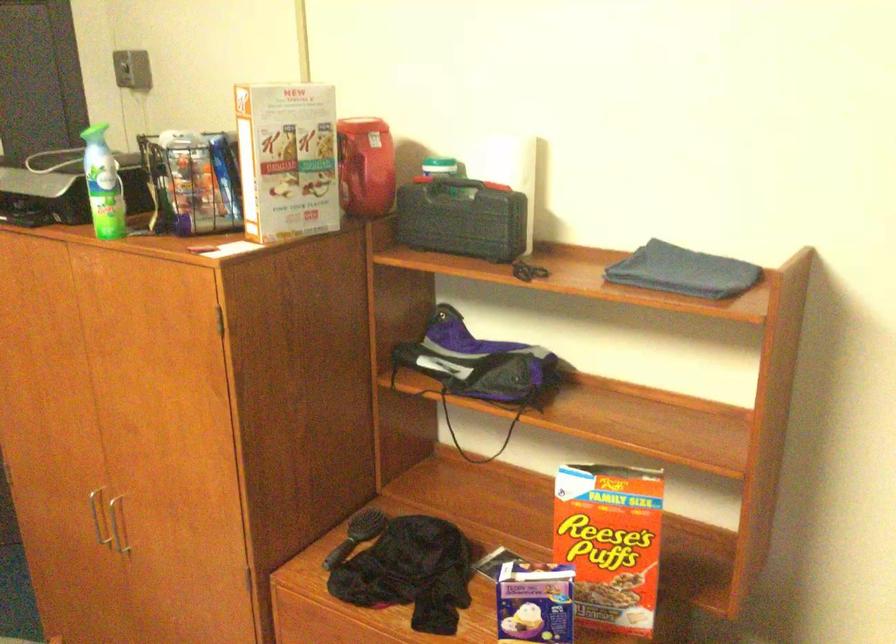
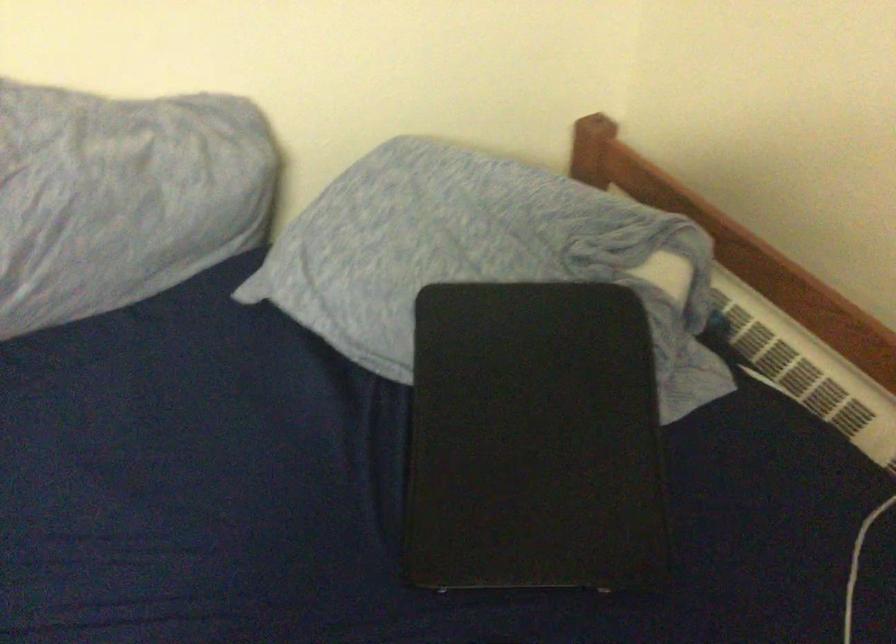
In the scene shown: The images are taken continuously from a first-person perspective. In which direction is your viewpoint rotating?

The camera rotated toward right-down.